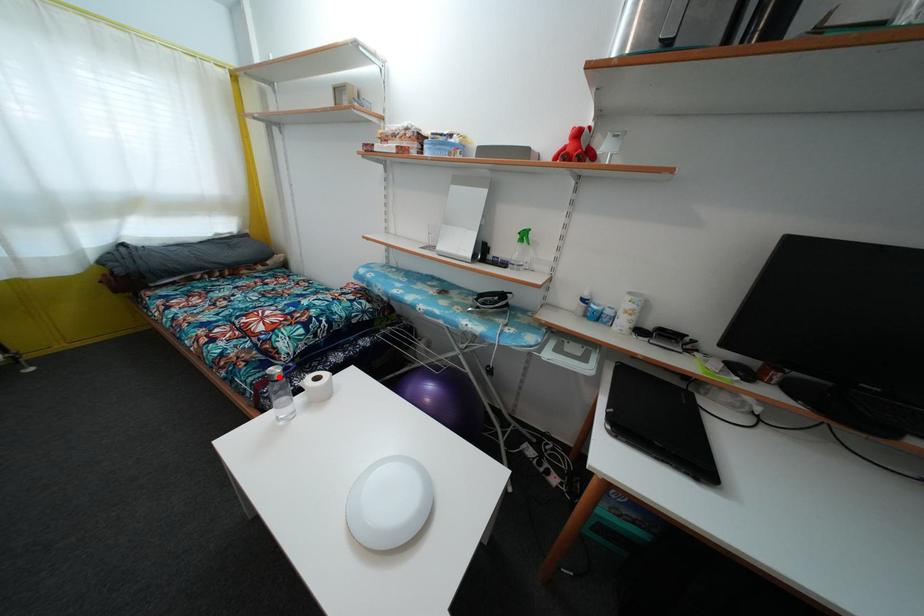
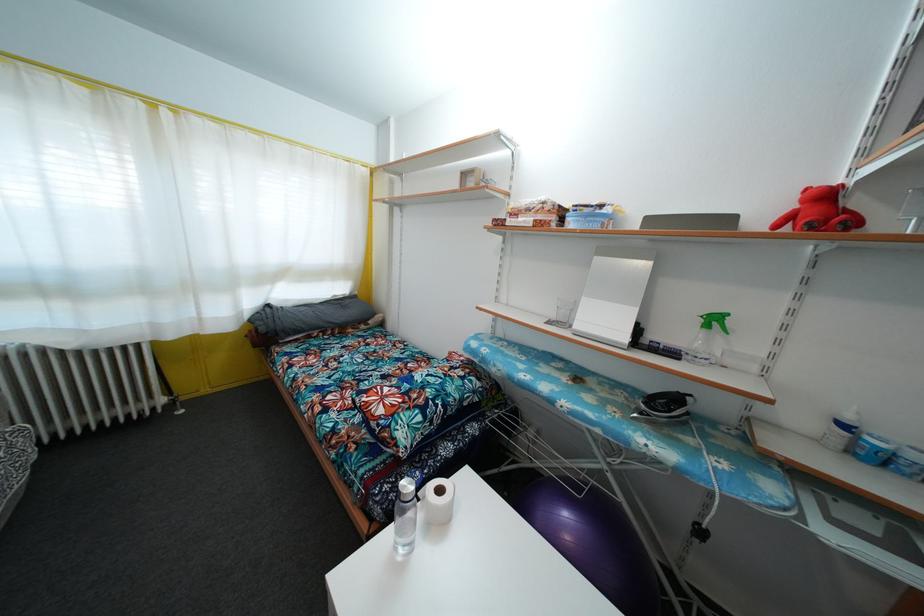
The point at the highlighted location is marked in the first image. Where is the corresponding point in the second image?

(410, 492)